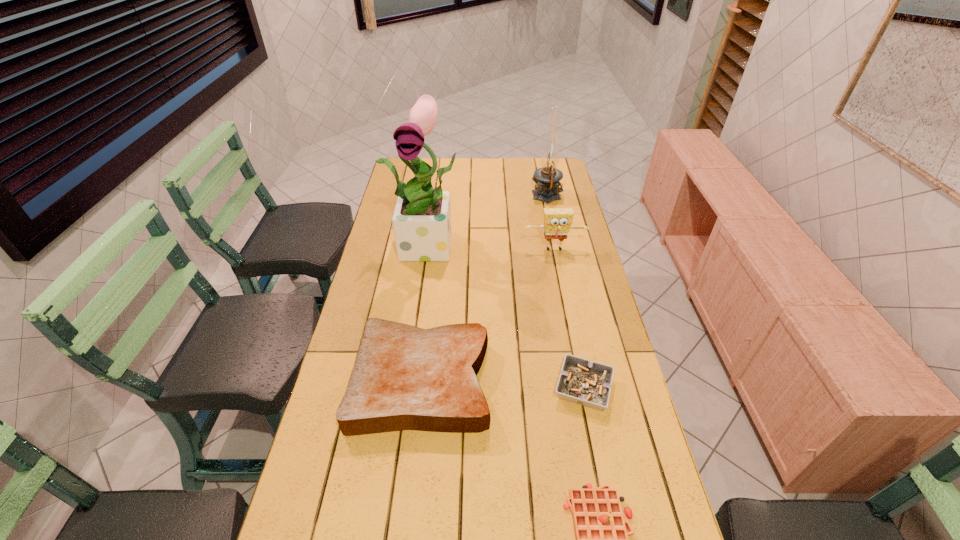
The width and height of the screenshot is (960, 540). What are the coordinates of `free space located 0.350m on the left of the fifth tallest object` in the screenshot? It's located at (422, 388).

Identify the location of flower arrangement that is at the left edge. 421,221.

Locate an element on the screen. bread positioned at the left edge is located at coordinates (404, 378).

Identify the location of oil lamp located at the right edge. (547, 178).

Identify the location of sponge that is at the right edge. Image resolution: width=960 pixels, height=540 pixels. (557, 222).

Find the location of `ashtray that is at the right edge`. ashtray that is at the right edge is located at coordinates (586, 383).

Locate an element on the screen. vacant space at the far edge of the desktop is located at coordinates 518,170.

Locate an element on the screen. vacant region at the left edge of the desktop is located at coordinates (291, 518).

Identify the location of free space at the right edge. (586, 238).

Locate an element on the screen. The image size is (960, 540). vacant point at the far right corner is located at coordinates (532, 167).